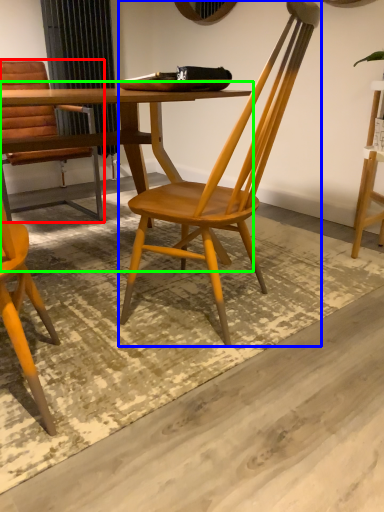
Question: Estimate the real-world distances between objects in this image. Which object is closer to chair (highlighted by a red box), chair (highlighted by a blue box) or table (highlighted by a green box)?

Choices:
 (A) chair
 (B) table

Answer: (B)